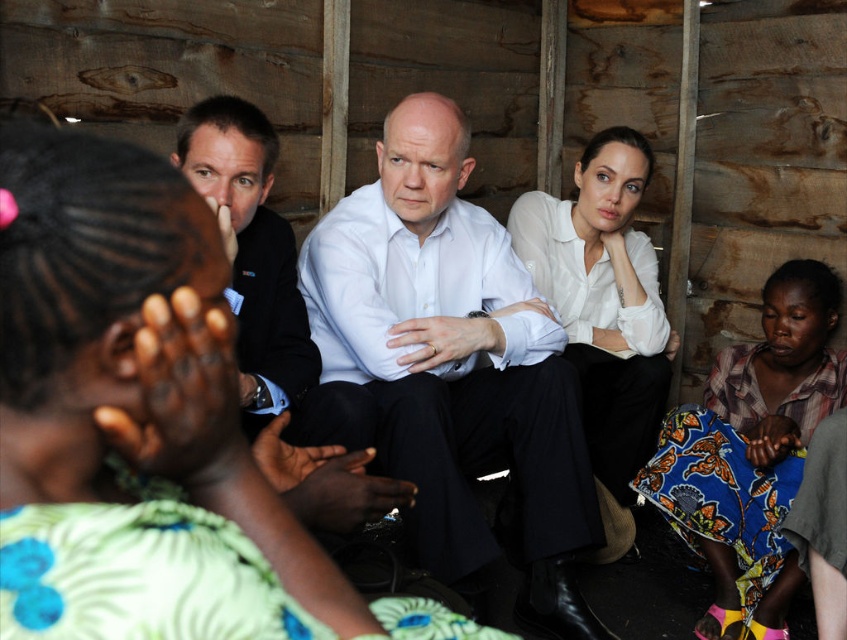
Question: Considering the real-world distances, which object is farthest from the matte white blouse at center?

Choices:
 (A) white sheer blouse at center
 (B) black suit at center

Answer: (A)

Question: Which object is closer to the camera taking this photo?

Choices:
 (A) matte white blouse at center
 (B) white smooth shirt at center
 (C) white sheer blouse at center

Answer: (A)

Question: Can you confirm if white smooth shirt at center is positioned above black suit at center?

Choices:
 (A) no
 (B) yes

Answer: (A)

Question: Considering the real-world distances, which object is closest to the matte white blouse at center?

Choices:
 (A) printed fabric dress at lower right
 (B) black suit at center
 (C) white sheer blouse at center

Answer: (B)

Question: Can you confirm if white smooth shirt at center is smaller than printed fabric dress at lower right?

Choices:
 (A) no
 (B) yes

Answer: (A)

Question: Does white smooth shirt at center appear over black suit at center?

Choices:
 (A) no
 (B) yes

Answer: (A)